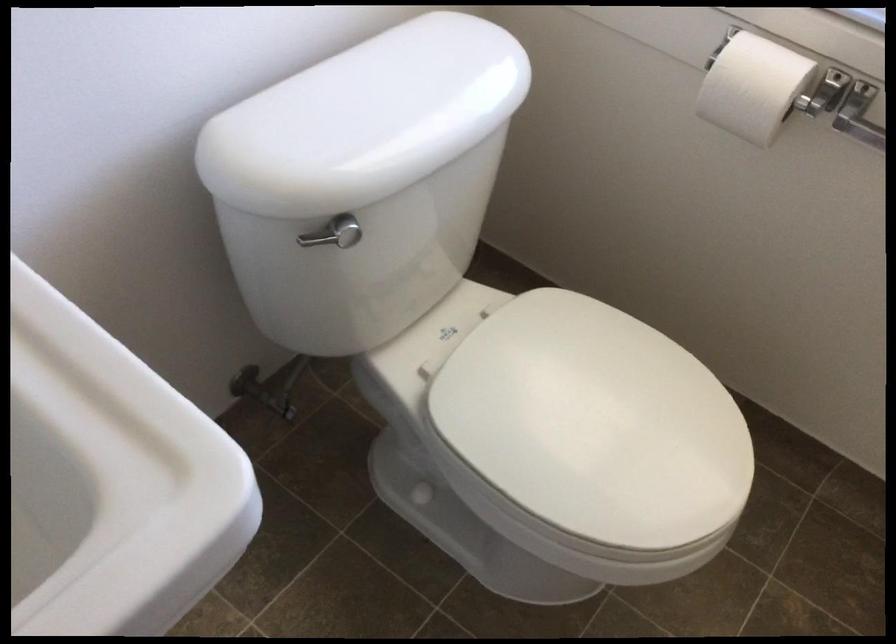
Locate an element on the screen. silver toilet handle is located at coordinates (333, 234).